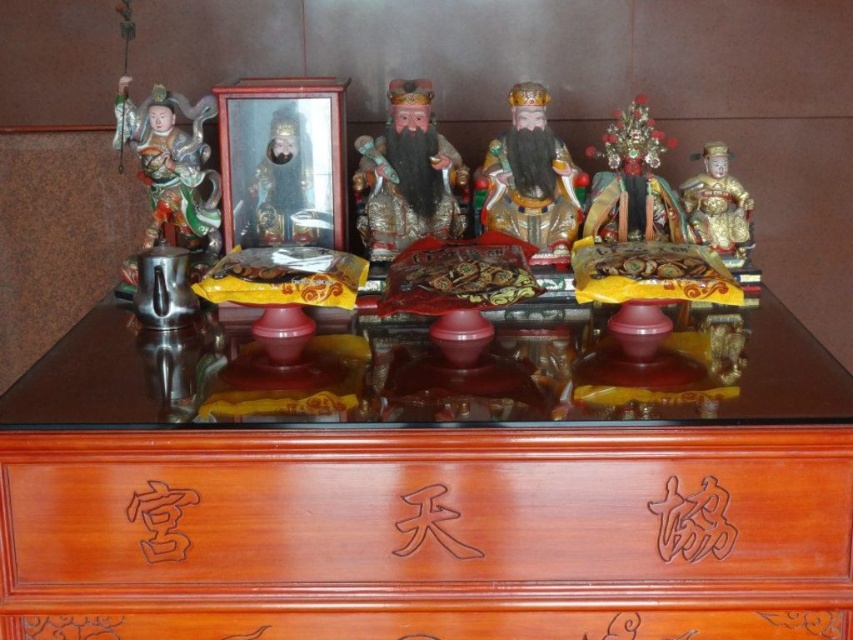
You are an art conservator examining the traditional Chinese altar. You need to determine which of the two figures, the shiny metallic figure at left or the gold lacquered statue at right, requires more space for preservation. Based on their sizes, which one should be prioritized for a larger storage area?

The shiny metallic figure at left is bigger than the gold lacquered statue at right, so it should be prioritized for a larger storage area to accommodate its size.

You are standing in front of the traditional Chinese altar and want to place a small offering directly in front of the glossy gold statue at center. Based on the altar layout, where should you place the offering relative to the statue?

The glossy gold statue at center is located at point [852,639], so you should place the offering directly in front of the glossy gold statue at center at that coordinate.

You are a temple caretaker who needs to place a new offering tray that is 50 centimeters wide between the glossy gold statue at center and the shiny metallic figure at left. Can the tray fit between them without overlapping either?

The glossy gold statue at center is 46.52 centimeters from the shiny metallic figure at left. Since the offering tray is 50 centimeters wide, it cannot fit between them without overlapping either statue.